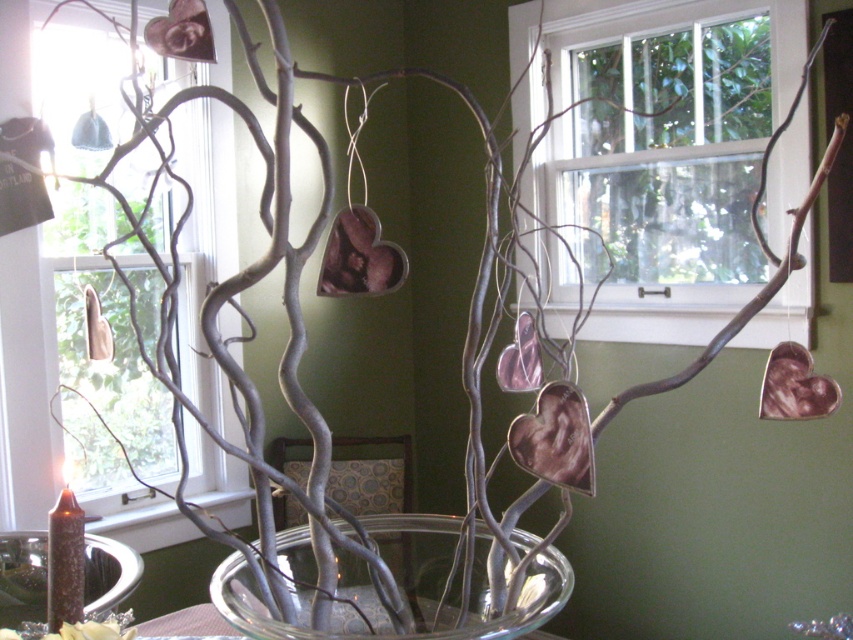
Based on the photo, you are standing in front of the glass bowl with branches and hearts. There are two points marked in the scene. Which point is closer to you, point 1 at coordinates (10, 568) or point 2 at coordinates (84, 634)?

Point 1 at coordinates (10, 568) is closer to you because it is further to the viewer than point 2 at coordinates (84, 634).